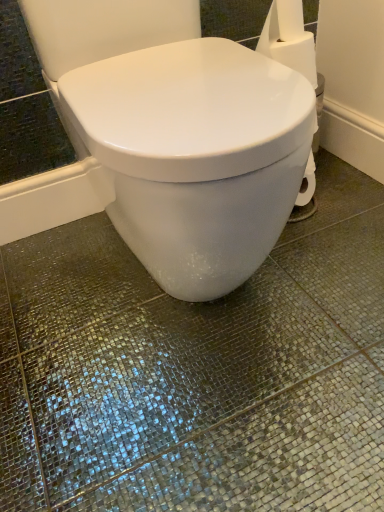
Question: Is white paper at upper right wider than white glossy toilet at center?

Choices:
 (A) no
 (B) yes

Answer: (A)

Question: Is white paper at upper right closer to camera compared to white glossy toilet at center?

Choices:
 (A) yes
 (B) no

Answer: (B)

Question: Does white paper at upper right appear on the right side of white glossy toilet at center?

Choices:
 (A) yes
 (B) no

Answer: (A)

Question: Can you confirm if white paper at upper right is smaller than white glossy toilet at center?

Choices:
 (A) yes
 (B) no

Answer: (A)

Question: Considering the relative positions of white paper at upper right and white glossy toilet at center in the image provided, is white paper at upper right to the left of white glossy toilet at center from the viewer's perspective?

Choices:
 (A) yes
 (B) no

Answer: (B)

Question: Can you confirm if white paper at upper right is taller than white glossy toilet at center?

Choices:
 (A) yes
 (B) no

Answer: (B)

Question: Is white glossy toilet at center at the left side of white paper at upper right?

Choices:
 (A) yes
 (B) no

Answer: (A)

Question: From the image's perspective, is white glossy toilet at center beneath white paper at upper right?

Choices:
 (A) yes
 (B) no

Answer: (A)

Question: Does white glossy toilet at center turn towards white paper at upper right?

Choices:
 (A) no
 (B) yes

Answer: (A)

Question: Is white glossy toilet at center closer to camera compared to white paper at upper right?

Choices:
 (A) yes
 (B) no

Answer: (A)

Question: Is white glossy toilet at center not close to white paper at upper right?

Choices:
 (A) yes
 (B) no

Answer: (B)

Question: Does white glossy toilet at center have a greater width compared to white paper at upper right?

Choices:
 (A) yes
 (B) no

Answer: (A)

Question: Is white paper at upper right situated inside white glossy toilet at center or outside?

Choices:
 (A) outside
 (B) inside

Answer: (A)